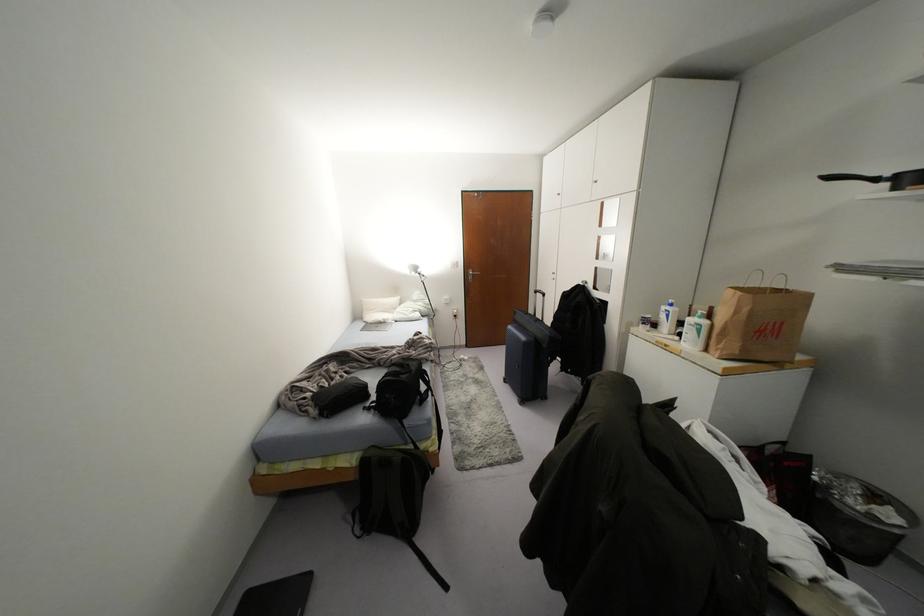
This screenshot has width=924, height=616. What do you see at coordinates (454, 264) in the screenshot?
I see `the white light switch` at bounding box center [454, 264].